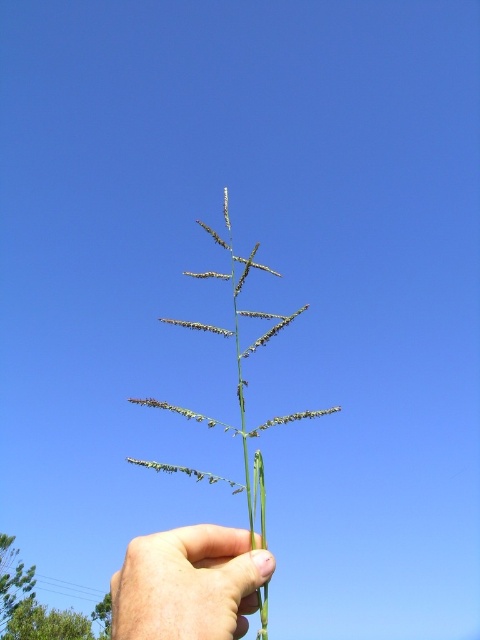
Between skinny green stem at center and green grass at center, which one appears on the left side from the viewer's perspective?

skinny green stem at center is more to the left.

In the scene shown: Measure the distance between skinny green stem at center and camera.

skinny green stem at center is 49.82 centimeters away from camera.

At what (x,y) coordinates should I click in order to perform the action: click on skinny green stem at center. Please return your answer as a coordinate pair (x, y). Looking at the image, I should click on (188, 584).